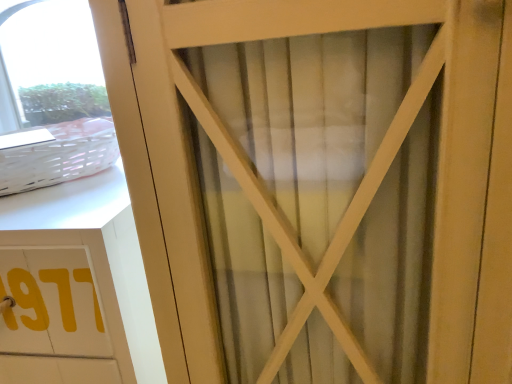
Question: Looking at the image, does white matte cabinet at left seem bigger or smaller compared to white woven basket at upper left?

Choices:
 (A) big
 (B) small

Answer: (A)

Question: In the image, is white matte cabinet at left on the left side or the right side of white woven basket at upper left?

Choices:
 (A) right
 (B) left

Answer: (B)

Question: In terms of width, does white matte cabinet at left look wider or thinner when compared to white woven basket at upper left?

Choices:
 (A) thin
 (B) wide

Answer: (B)

Question: From the image's perspective, is white woven basket at upper left above or below white matte cabinet at left?

Choices:
 (A) above
 (B) below

Answer: (A)

Question: In terms of size, does white woven basket at upper left appear bigger or smaller than white matte cabinet at left?

Choices:
 (A) small
 (B) big

Answer: (A)

Question: Visually, is white woven basket at upper left positioned to the left or to the right of white matte cabinet at left?

Choices:
 (A) left
 (B) right

Answer: (B)

Question: Relative to white matte cabinet at left, is white woven basket at upper left in front or behind?

Choices:
 (A) behind
 (B) front

Answer: (A)